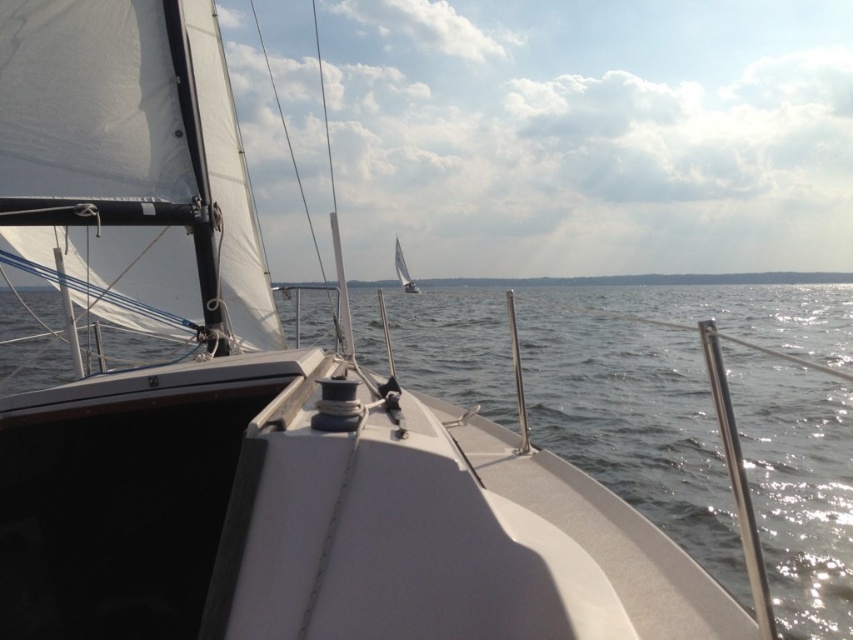
Question: Is white cloud at upper center to the left of white sailboat at center from the viewer's perspective?

Choices:
 (A) no
 (B) yes

Answer: (A)

Question: Which of the following is the farthest from the observer?

Choices:
 (A) white sailboat at center
 (B) white cloud at upper center

Answer: (A)

Question: Is white cloud at upper center further to the viewer compared to white sailboat at center?

Choices:
 (A) no
 (B) yes

Answer: (A)

Question: Which point is farther from the camera taking this photo?

Choices:
 (A) (636, 189)
 (B) (410, 292)

Answer: (A)

Question: Can you confirm if white cloud at upper center is positioned above white sailboat at center?

Choices:
 (A) yes
 (B) no

Answer: (A)